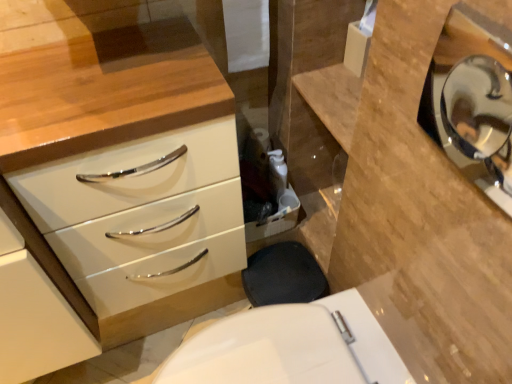
Question: Considering the positions of white glossy chest of drawers at left and polished silver mirror at upper right in the image, is white glossy chest of drawers at left wider or thinner than polished silver mirror at upper right?

Choices:
 (A) wide
 (B) thin

Answer: (A)

Question: Is white glossy chest of drawers at left situated inside polished silver mirror at upper right or outside?

Choices:
 (A) inside
 (B) outside

Answer: (B)

Question: Estimate the real-world distances between objects in this image. Which object is closer to the white glossy toilet at lower center?

Choices:
 (A) polished silver mirror at upper right
 (B) white glossy chest of drawers at left

Answer: (B)

Question: Estimate the real-world distances between objects in this image. Which object is closer to the white glossy chest of drawers at left?

Choices:
 (A) polished silver mirror at upper right
 (B) white glossy toilet at lower center

Answer: (B)